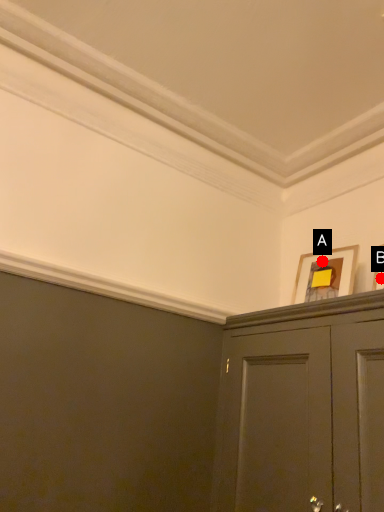
Question: Two points are circled on the image, labeled by A and B beside each circle. Which point is further to the camera?

Choices:
 (A) A is further
 (B) B is further

Answer: (A)